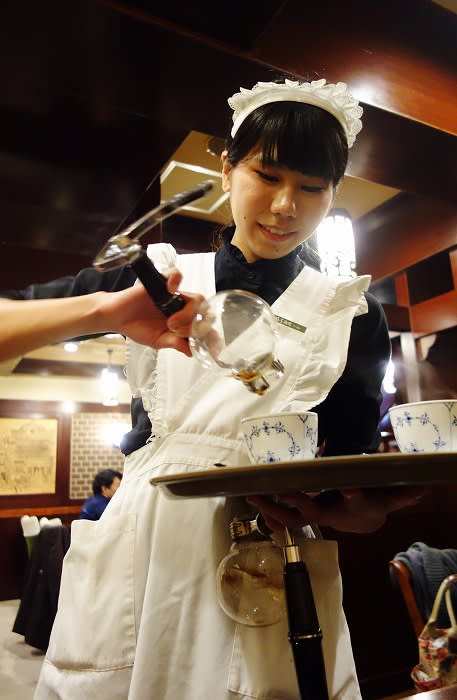
Where is `edge of table`? The width and height of the screenshot is (457, 700). edge of table is located at coordinates (338, 467).